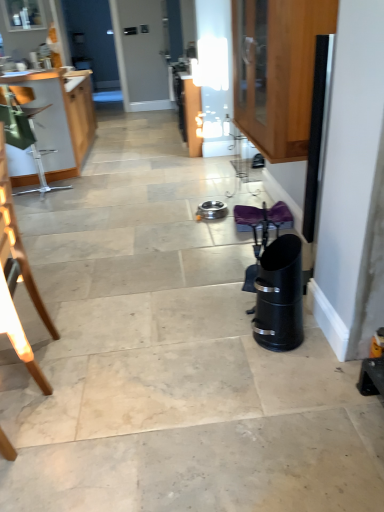
Question: Is wooden cabinet at left, which is the 1th cabinetry from back to front, at the back of wooden chair at left?

Choices:
 (A) no
 (B) yes

Answer: (A)

Question: Considering the relative sizes of wooden chair at left and wooden cabinet at left, which is the first cabinetry in left-to-right order, in the image provided, is wooden chair at left wider than wooden cabinet at left, which is the first cabinetry in left-to-right order,?

Choices:
 (A) yes
 (B) no

Answer: (B)

Question: Considering the relative sizes of wooden chair at left and wooden cabinet at left, which is the 1th cabinetry from back to front, in the image provided, is wooden chair at left shorter than wooden cabinet at left, which is the 1th cabinetry from back to front,?

Choices:
 (A) no
 (B) yes

Answer: (A)

Question: From the image's perspective, is wooden chair at left on wooden cabinet at left, which is the 1th cabinetry from back to front?

Choices:
 (A) yes
 (B) no

Answer: (B)

Question: Is wooden chair at left taller than wooden cabinet at left, acting as the 2th cabinetry starting from the front?

Choices:
 (A) no
 (B) yes

Answer: (B)

Question: Considering the relative sizes of wooden chair at left and wooden cabinet at left, acting as the 2th cabinetry starting from the front, in the image provided, is wooden chair at left thinner than wooden cabinet at left, acting as the 2th cabinetry starting from the front,?

Choices:
 (A) no
 (B) yes

Answer: (B)

Question: Can you confirm if wooden cabinet at upper right, which ranks as the 2th cabinetry in left-to-right order, is taller than wooden cabinet at left, which is the first cabinetry in left-to-right order?

Choices:
 (A) no
 (B) yes

Answer: (A)

Question: Can we say wooden cabinet at upper right, positioned as the 1th cabinetry in right-to-left order, lies outside wooden cabinet at left, which is the 1th cabinetry from back to front?

Choices:
 (A) no
 (B) yes

Answer: (B)

Question: Does wooden cabinet at upper right, which appears as the 1th cabinetry when viewed from the front, lie in front of wooden cabinet at left, the 2th cabinetry positioned from the right?

Choices:
 (A) no
 (B) yes

Answer: (B)

Question: Is wooden cabinet at upper right, positioned as the 1th cabinetry in right-to-left order, shorter than wooden cabinet at left, which is the first cabinetry in left-to-right order?

Choices:
 (A) yes
 (B) no

Answer: (A)

Question: Could you tell me if wooden cabinet at upper right, positioned as the 1th cabinetry in right-to-left order, is facing wooden cabinet at left, the 2th cabinetry positioned from the right?

Choices:
 (A) no
 (B) yes

Answer: (A)

Question: From a real-world perspective, is wooden cabinet at left, which is the 1th cabinetry from back to front, located beneath wooden cabinet at upper right, which appears as the 1th cabinetry when viewed from the front?

Choices:
 (A) yes
 (B) no

Answer: (A)